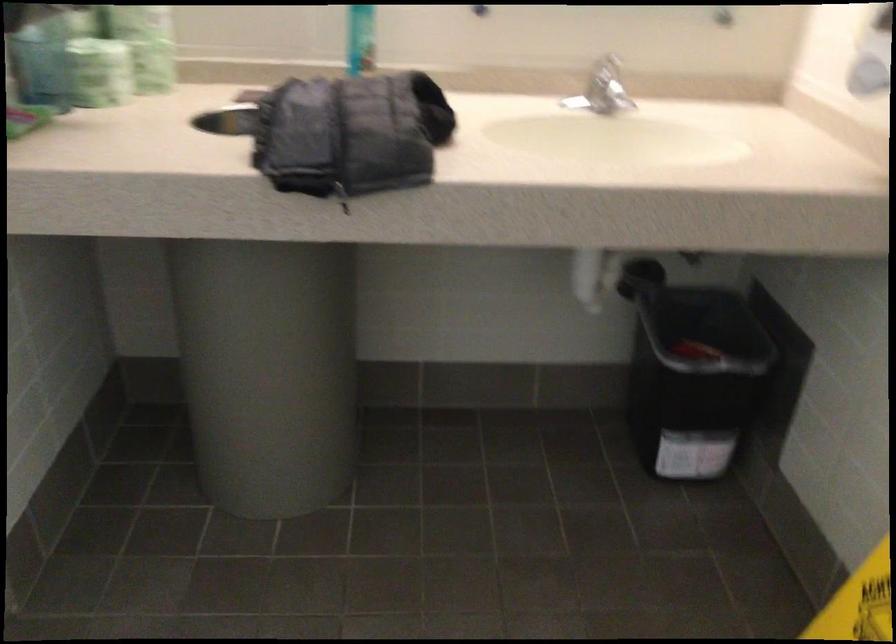
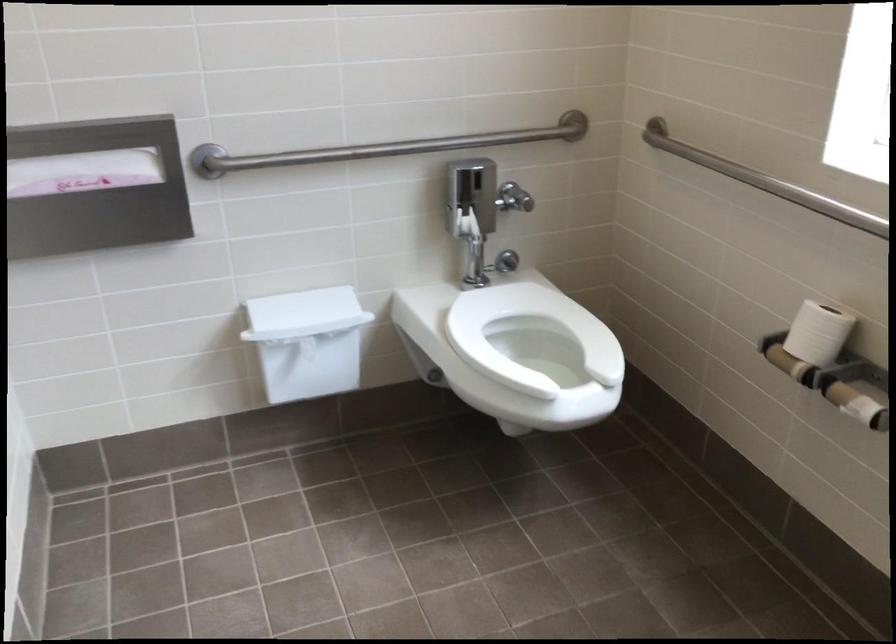
Question: The images are taken continuously from a first-person perspective. In which direction are you moving?

Choices:
 (A) Left
 (B) Right
 (C) Forward
 (D) Backward

Answer: (B)